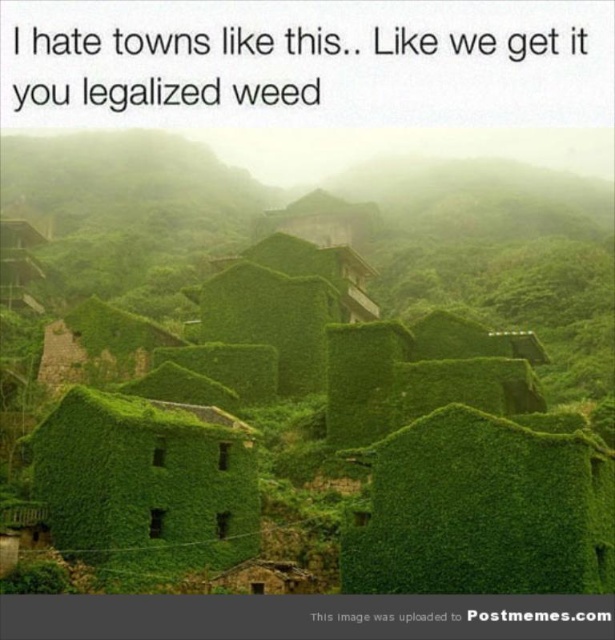
Question: Which of the following is the farthest from the observer?

Choices:
 (A) (228, 500)
 (B) (132, 346)

Answer: (B)

Question: Does green moss-covered buildings at center appear over green ivy-covered hut at center?

Choices:
 (A) no
 (B) yes

Answer: (B)

Question: Is green moss-covered buildings at center to the left of green ivy-covered hut at center from the viewer's perspective?

Choices:
 (A) no
 (B) yes

Answer: (A)

Question: Where is green moss-covered buildings at center located in relation to green ivy-covered hut at center in the image?

Choices:
 (A) below
 (B) above

Answer: (B)

Question: Which of the following is the farthest from the observer?

Choices:
 (A) (565, 308)
 (B) (121, 474)

Answer: (A)